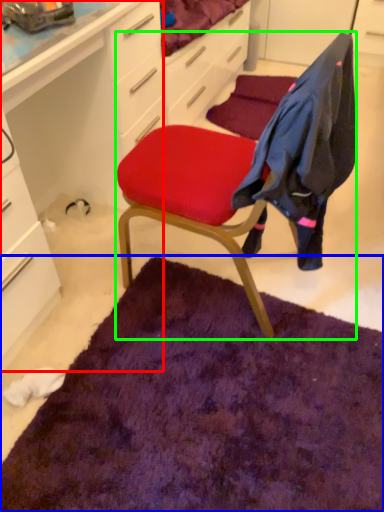
Question: Which is nearer to the computer desk (highlighted by a red box)? mat (highlighted by a blue box) or chair (highlighted by a green box).

Choices:
 (A) mat
 (B) chair

Answer: (B)